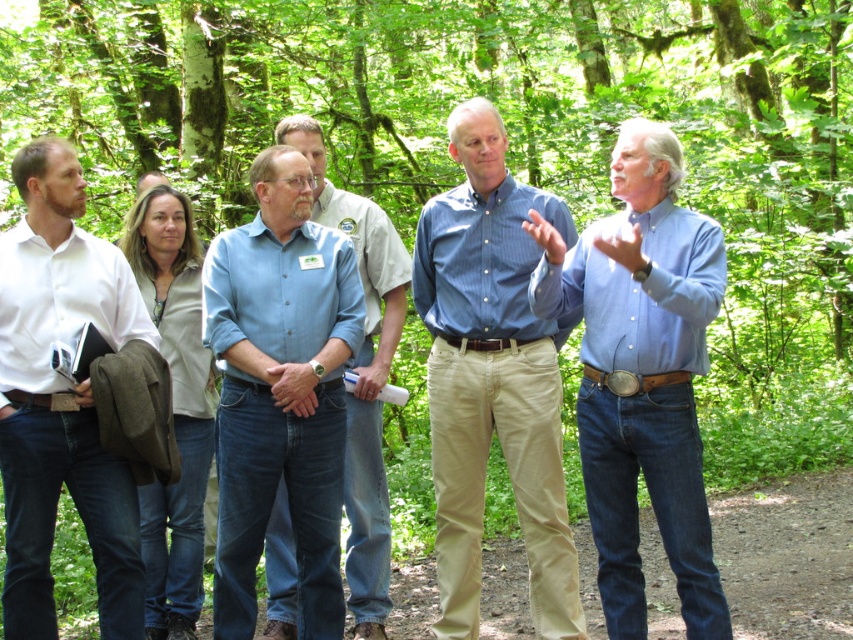
Question: Considering the real-world distances, which object is closest to the blue striped shirt at center?

Choices:
 (A) white shirt at left
 (B) blue denim shirt at center
 (C) blue button-down shirt at center

Answer: (B)

Question: Which is nearer to the blue denim shirt at center?

Choices:
 (A) blue cotton shirt at center
 (B) blue striped shirt at center

Answer: (B)

Question: Where is blue denim shirt at center located in relation to blue striped shirt at center in the image?

Choices:
 (A) above
 (B) below

Answer: (B)

Question: Which point appears closest to the camera in this image?

Choices:
 (A) (22, 364)
 (B) (521, 506)
 (C) (316, 454)
 (D) (675, 429)

Answer: (D)

Question: Is blue striped shirt at center to the right of blue button-down shirt at center from the viewer's perspective?

Choices:
 (A) no
 (B) yes

Answer: (B)

Question: Is blue striped shirt at center further to the viewer compared to blue button-down shirt at center?

Choices:
 (A) yes
 (B) no

Answer: (B)